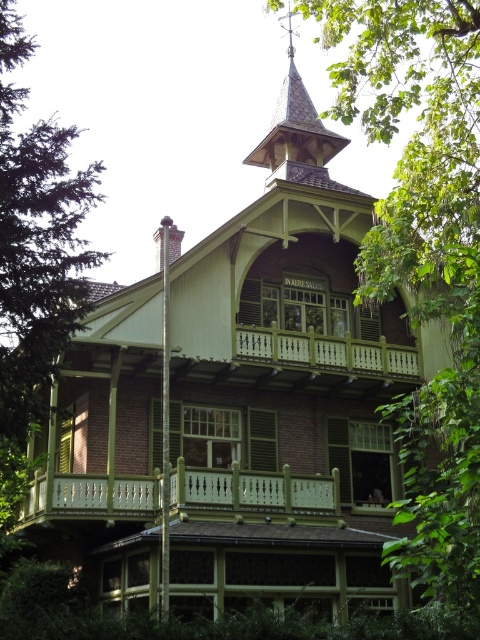
Question: Is the position of green leafy tree at upper center more distant than that of wooden spire at upper center?

Choices:
 (A) yes
 (B) no

Answer: (B)

Question: Which of the following is the closest to the observer?

Choices:
 (A) (425, 106)
 (B) (346, 140)
 (C) (334, 493)

Answer: (C)

Question: Which point appears closest to the camera in this image?

Choices:
 (A) (296, 160)
 (B) (465, 113)

Answer: (B)

Question: Is green painted wood balustrade at center in front of wooden spire at upper center?

Choices:
 (A) yes
 (B) no

Answer: (A)

Question: From the image, what is the correct spatial relationship of green leafy tree at upper center in relation to wooden spire at upper center?

Choices:
 (A) right
 (B) left

Answer: (A)

Question: Among these points, which one is farthest from the camera?

Choices:
 (A) (369, 296)
 (B) (300, 157)

Answer: (B)